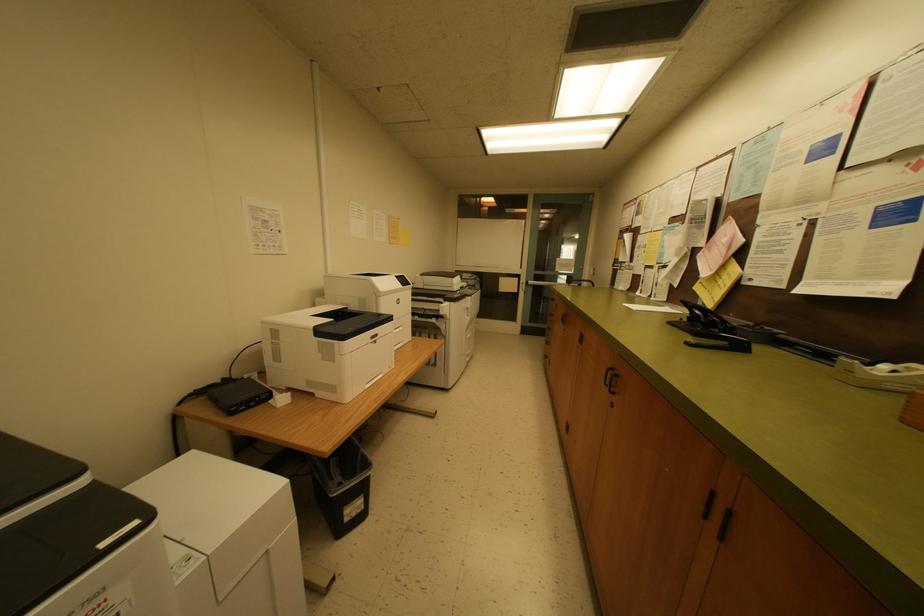
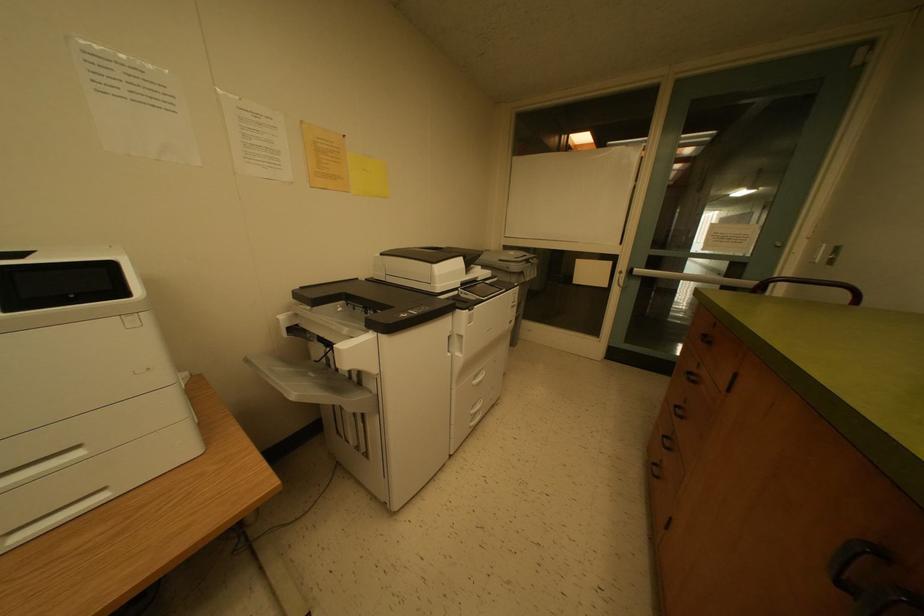
Question: The images are taken continuously from a first-person perspective. In which direction are you moving?

Choices:
 (A) Left
 (B) Right
 (C) Forward
 (D) Backward

Answer: (C)